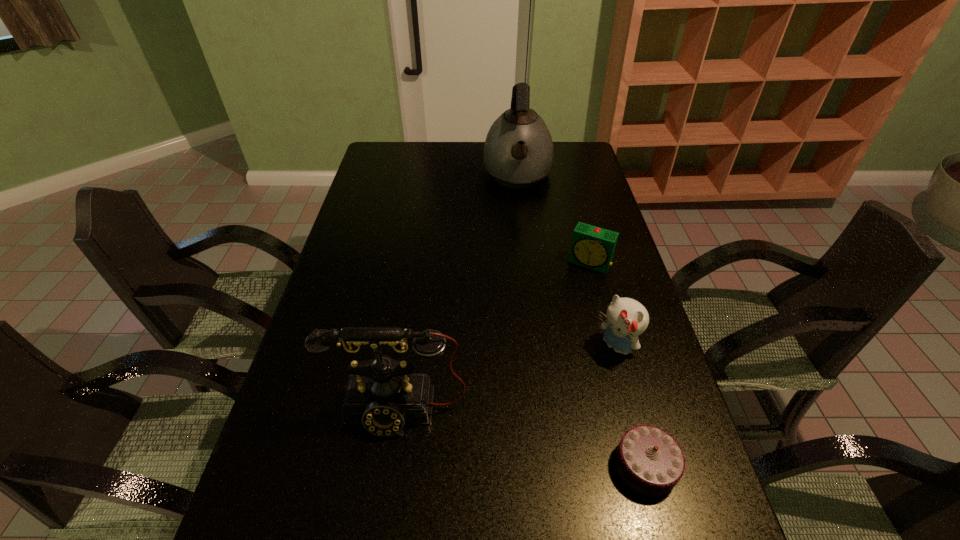
Image resolution: width=960 pixels, height=540 pixels. I want to click on free region located on the left of the shortest object, so click(x=431, y=465).

At what (x,y) coordinates should I click in order to perform the action: click on vacant area situated 0.400m on the front-facing side of the kitten. Please return your answer as a coordinate pair (x, y). The image size is (960, 540). Looking at the image, I should click on (487, 470).

The height and width of the screenshot is (540, 960). In order to click on vacant space located on the front-facing side of the kitten in this screenshot , I will do `click(535, 424)`.

At what (x,y) coordinates should I click in order to perform the action: click on free space located on the front-facing side of the kitten. Please return your answer as a coordinate pair (x, y). Looking at the image, I should click on click(535, 424).

The image size is (960, 540). In order to click on vacant region located on the front-facing side of the fourth tallest object in this screenshot , I will do `click(540, 358)`.

Identify the location of vacant area located 0.100m on the front-facing side of the fourth tallest object. The image size is (960, 540). (571, 294).

Locate an element on the screen. Image resolution: width=960 pixels, height=540 pixels. free region located on the front-facing side of the fourth tallest object is located at coordinates (555, 328).

Find the location of `free space located at the spout of the tallest object`. free space located at the spout of the tallest object is located at coordinates [x=518, y=261].

The width and height of the screenshot is (960, 540). In order to click on vacant area located 0.090m at the spout of the tallest object in this screenshot , I will do `click(518, 219)`.

Find the location of `free spot located 0.050m at the spout of the tallest object`. free spot located 0.050m at the spout of the tallest object is located at coordinates (518, 212).